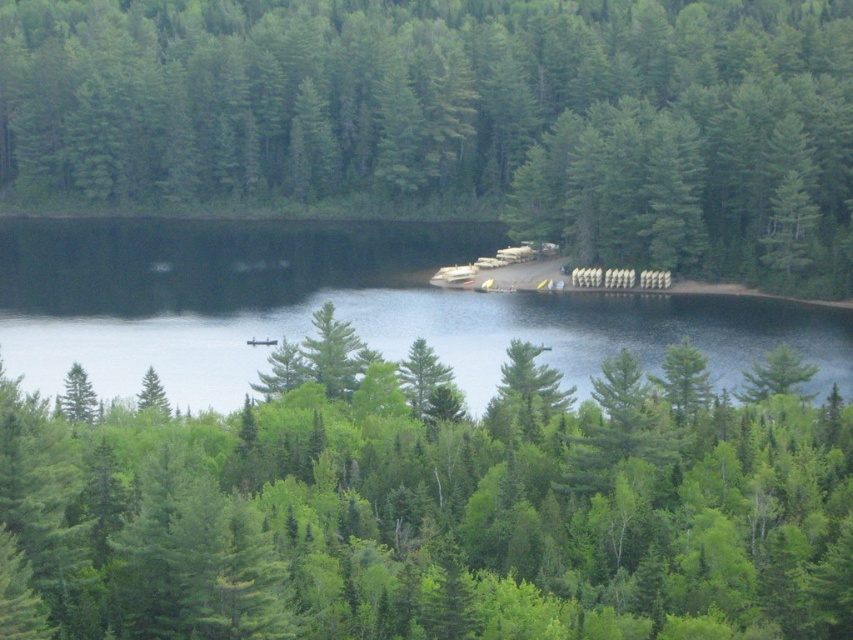
Question: Can you confirm if green matte tree at center is smaller than green matte trees at center?

Choices:
 (A) yes
 (B) no

Answer: (A)

Question: Is green matte tree at center behind clear water at center?

Choices:
 (A) yes
 (B) no

Answer: (B)

Question: Which point is closer to the camera taking this photo?

Choices:
 (A) (413, 284)
 (B) (202, 52)

Answer: (A)

Question: Which point appears farthest from the camera in this image?

Choices:
 (A) (664, 100)
 (B) (368, 253)
 (C) (383, 500)

Answer: (A)

Question: Which point is closer to the camera taking this photo?

Choices:
 (A) (33, 198)
 (B) (531, 620)

Answer: (B)

Question: Can you confirm if green matte trees at center is positioned above clear water at center?

Choices:
 (A) no
 (B) yes

Answer: (B)